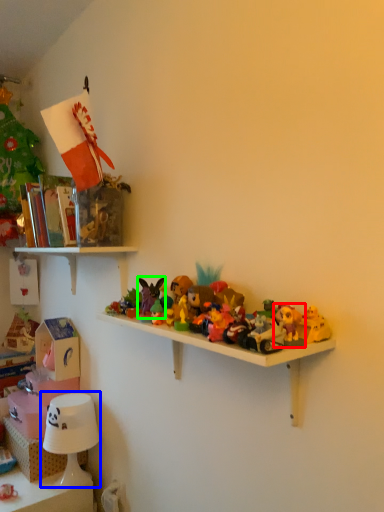
Question: Which object is the farthest from toy (highlighted by a red box)? Choose among these: table lamp (highlighted by a blue box) or toy (highlighted by a green box).

Choices:
 (A) table lamp
 (B) toy

Answer: (A)